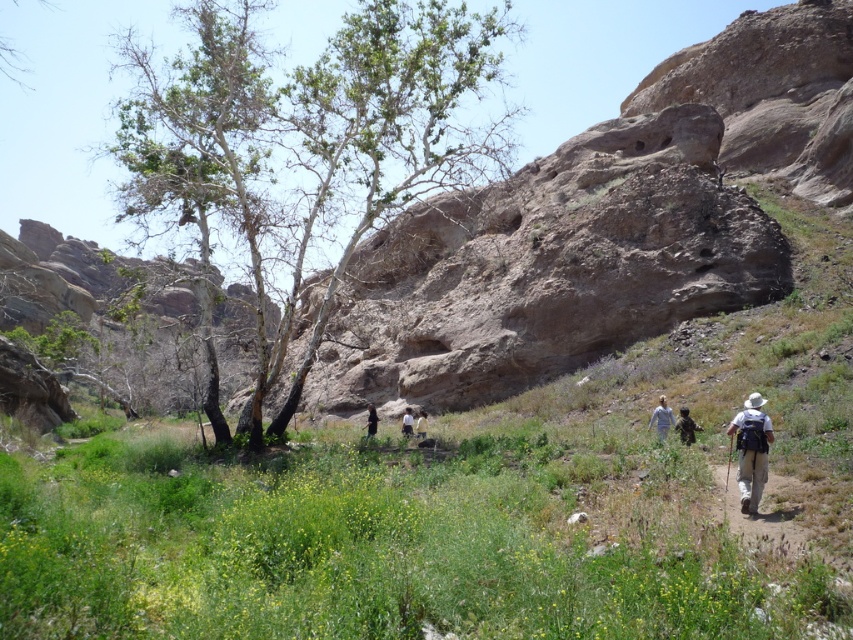
You are a hiker planning to set up a campsite in the area. Given the presence of the green leafy grass at lower center and the green leafy tree at center, which of these two would provide more coverage for shade?

The green leafy tree at center provides more coverage for shade because it occupies more space than the green leafy grass at lower center.

You are a hiker who wants to know if the white cotton shirt at lower right can fit into the same backpack compartment as the white cotton shirt at center. Based on their sizes, which one is smaller?

The white cotton shirt at lower right is smaller than the white cotton shirt at center, so it can fit into the same backpack compartment.

You are a hiker who just arrived at the trailhead and see the khaki fabric backpack at lower right and the white cotton shirt at lower right. Which item is closer to you?

The khaki fabric backpack at lower right is closer to you because it is in front of the white cotton shirt at lower right.